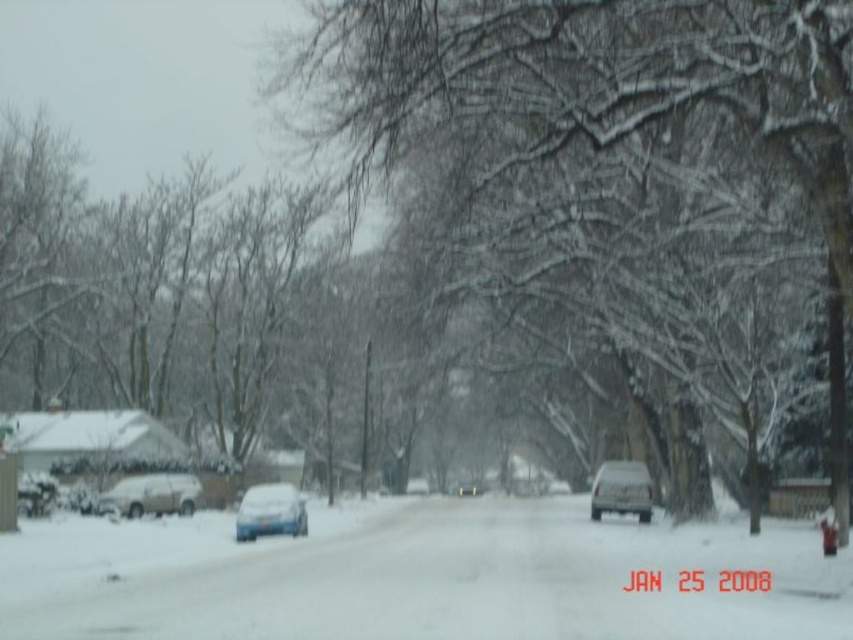
You are a delivery driver trying to navigate through the snowy street. You need to drive straight ahead. Is the white powdery snow at center in your way between you and the matte silver truck at center?

The white powdery snow at center is to the left of the matte silver truck at center, so it is not directly in the path between you and the matte silver truck at center. You can drive straight ahead without obstruction from the snow in that area.

You are driving a car and need to stop at the snowiest part of the road. Based on the scene, where should you position your car to stop on the white powdery snow at center without blocking the matte silver truck at center?

You should position your car to stop on the white powdery snow at center in front of the matte silver truck at center, as the snow is in front of the truck and will not block it.